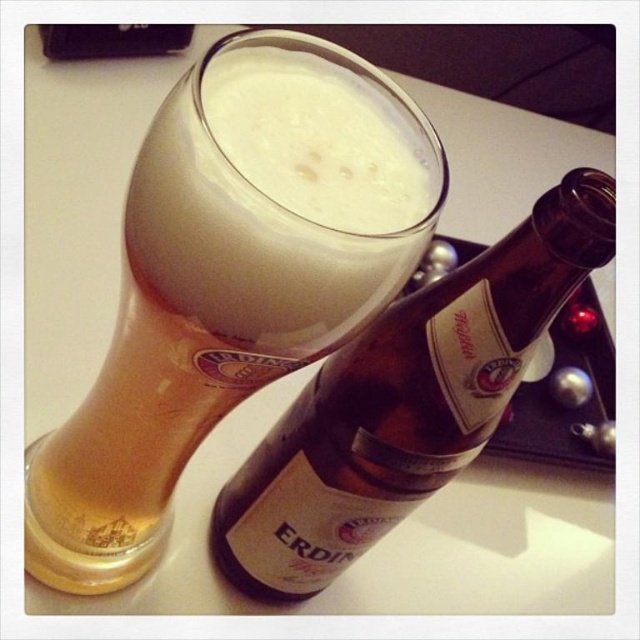
Question: Is golden glass beer at center positioned in front of foamy white beer at upper center?

Choices:
 (A) no
 (B) yes

Answer: (A)

Question: Among these objects, which one is farthest from the camera?

Choices:
 (A) brown glass bottle at upper center
 (B) golden glass beer at center
 (C) foamy white beer at upper center

Answer: (A)

Question: Does golden glass beer at center lie in front of brown glass bottle at upper center?

Choices:
 (A) no
 (B) yes

Answer: (B)

Question: Which point is closer to the camera?

Choices:
 (A) click(269, 435)
 (B) click(435, 211)
 (C) click(321, 296)

Answer: (C)

Question: Can you confirm if golden glass beer at center is positioned above foamy white beer at upper center?

Choices:
 (A) yes
 (B) no

Answer: (B)

Question: Among these objects, which one is nearest to the camera?

Choices:
 (A) foamy white beer at upper center
 (B) brown glass bottle at upper center

Answer: (A)